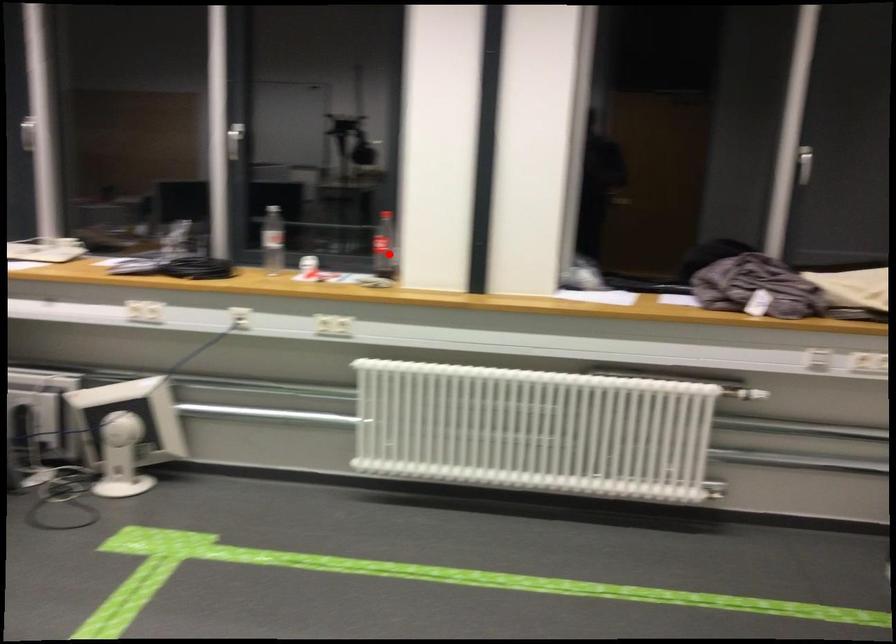
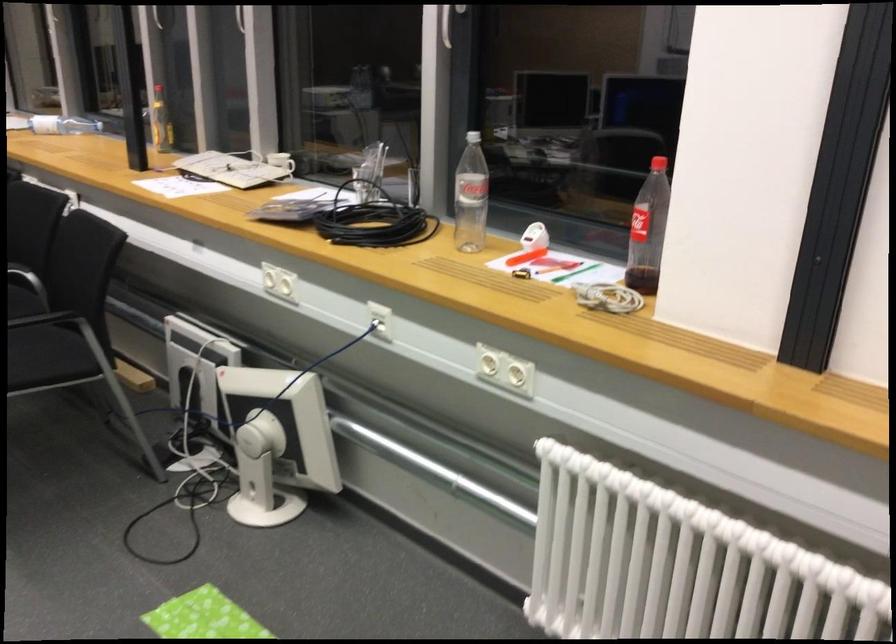
Question: I am providing you with two images of the same scene from different viewpoints. In image1, a red point is highlighted. Considering the same 3D point in image2, which of the following is correct?

Choices:
 (A) It is closer
 (B) It is farther

Answer: (A)